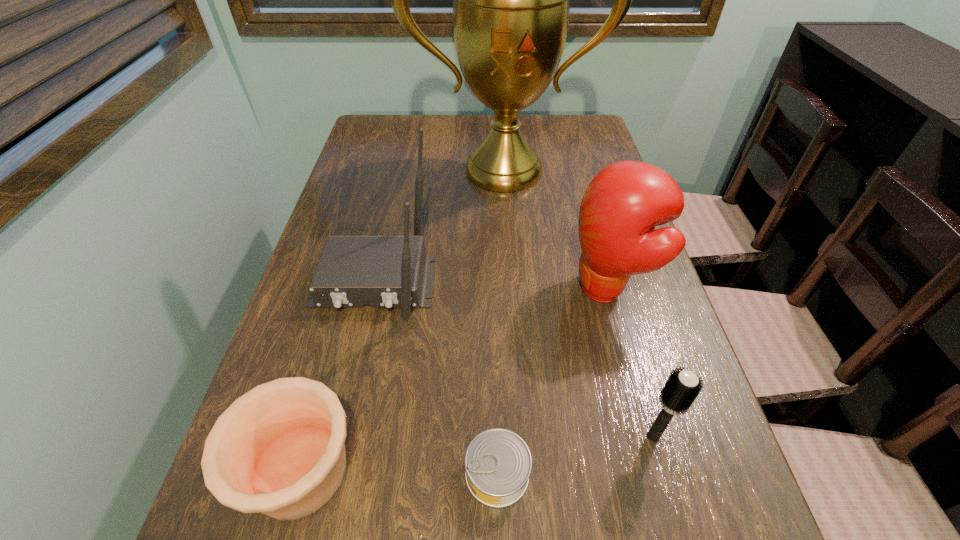
I want to click on hairbrush located at the right edge, so click(681, 389).

The height and width of the screenshot is (540, 960). In order to click on object situated at the far right corner in this screenshot , I will do `click(511, 0)`.

Image resolution: width=960 pixels, height=540 pixels. I want to click on vacant region at the far edge, so tap(456, 147).

Identify the location of vacant space at the left edge of the desktop. The height and width of the screenshot is (540, 960). (275, 363).

You are a GUI agent. You are given a task and a screenshot of the screen. Output one action in this format:
    pyautogui.click(x=<x>, y=<y>)
    Task: Click on the vacant region at the right edge
    Image resolution: width=960 pixels, height=540 pixels.
    Given the screenshot: What is the action you would take?
    pyautogui.click(x=651, y=414)

This screenshot has width=960, height=540. What are the coordinates of `vacant space at the far left corner` in the screenshot? It's located at (394, 143).

In the image, there is a desktop. In order to click on vacant space at the far right corner in this screenshot , I will do `click(588, 118)`.

At what (x,y) coordinates should I click in order to perform the action: click on free space between the boxing glove and the can. Please return your answer as a coordinate pair (x, y). This screenshot has height=540, width=960. Looking at the image, I should click on (552, 381).

Locate an element on the screen. vacant area that lies between the farthest object and the router is located at coordinates (439, 226).

This screenshot has width=960, height=540. I want to click on empty space between the router and the fourth tallest object, so click(x=514, y=359).